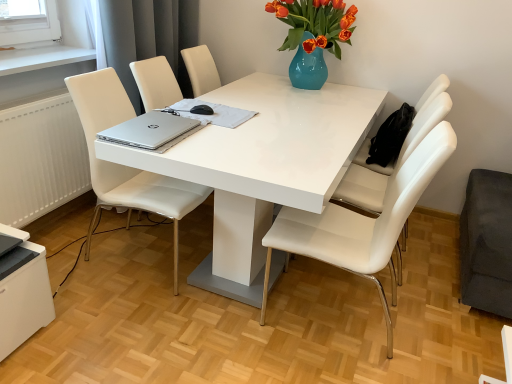
Identify the location of vacant space underneath white leather chair at center, the third chair viewed from the right (from a real-world perspective). The image size is (512, 384). (136, 253).